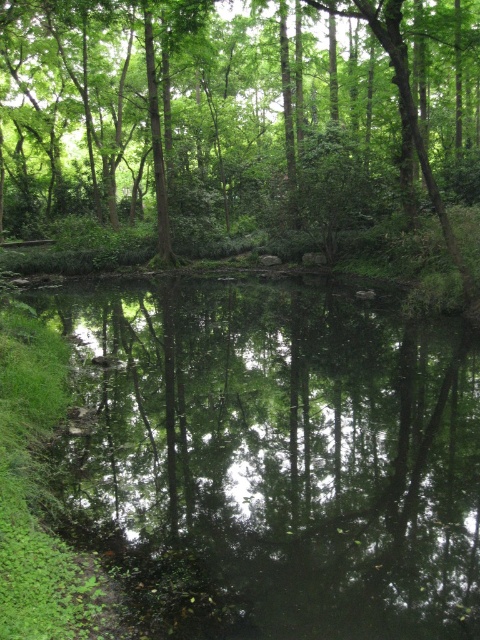
Question: Which of the following is the closest to the observer?

Choices:
 (A) green reflective water at center
 (B) green leafy tree at center

Answer: (A)

Question: Can you confirm if green reflective water at center is positioned to the right of green leafy tree at center?

Choices:
 (A) yes
 (B) no

Answer: (A)

Question: Which object appears closest to the camera in this image?

Choices:
 (A) green leafy tree at center
 (B) green reflective water at center

Answer: (B)

Question: Considering the relative positions of green reflective water at center and green leafy tree at center in the image provided, where is green reflective water at center located with respect to green leafy tree at center?

Choices:
 (A) left
 (B) right

Answer: (B)

Question: Considering the relative positions of green reflective water at center and green leafy tree at center in the image provided, where is green reflective water at center located with respect to green leafy tree at center?

Choices:
 (A) above
 (B) below

Answer: (B)